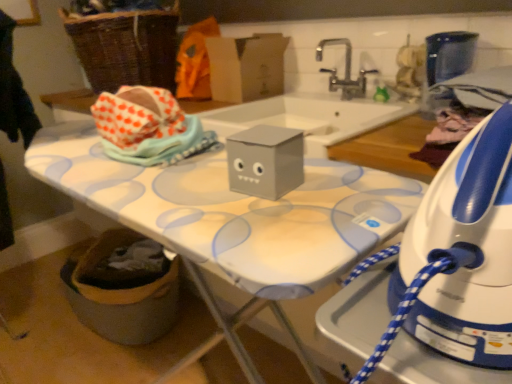
Question: Considering the relative positions of cardboard box at upper center and silver metallic faucet at upper center in the image provided, is cardboard box at upper center to the left of silver metallic faucet at upper center from the viewer's perspective?

Choices:
 (A) yes
 (B) no

Answer: (A)

Question: From a real-world perspective, is cardboard box at upper center located beneath silver metallic faucet at upper center?

Choices:
 (A) yes
 (B) no

Answer: (B)

Question: Does cardboard box at upper center come behind silver metallic faucet at upper center?

Choices:
 (A) no
 (B) yes

Answer: (B)

Question: Is cardboard box at upper center taller than silver metallic faucet at upper center?

Choices:
 (A) yes
 (B) no

Answer: (A)

Question: Is cardboard box at upper center closer to camera compared to silver metallic faucet at upper center?

Choices:
 (A) yes
 (B) no

Answer: (B)

Question: From the image's perspective, is cardboard box at upper center over silver metallic faucet at upper center?

Choices:
 (A) yes
 (B) no

Answer: (A)

Question: Is orange fabric at upper center shorter than cardboard box at upper center?

Choices:
 (A) no
 (B) yes

Answer: (A)

Question: Does orange fabric at upper center contain cardboard box at upper center?

Choices:
 (A) yes
 (B) no

Answer: (B)

Question: From the image's perspective, is orange fabric at upper center located beneath cardboard box at upper center?

Choices:
 (A) yes
 (B) no

Answer: (B)

Question: Can you confirm if orange fabric at upper center is bigger than cardboard box at upper center?

Choices:
 (A) yes
 (B) no

Answer: (A)

Question: Are orange fabric at upper center and cardboard box at upper center making contact?

Choices:
 (A) yes
 (B) no

Answer: (B)

Question: Is orange fabric at upper center positioned behind cardboard box at upper center?

Choices:
 (A) no
 (B) yes

Answer: (B)

Question: Does white plastic iron at right touch silver metallic faucet at upper center?

Choices:
 (A) no
 (B) yes

Answer: (A)